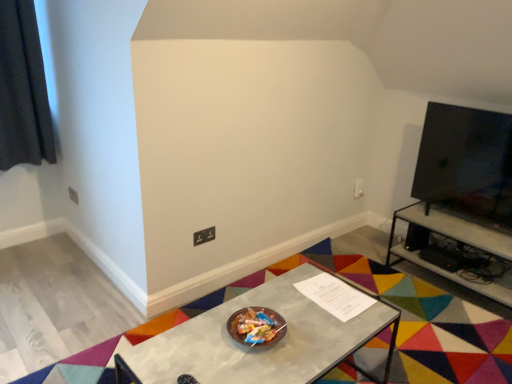
Question: Is metallic gray table at center, marked as the 1th table in a front-to-back arrangement, wider or thinner than matte black power outlet at lower center?

Choices:
 (A) thin
 (B) wide

Answer: (B)

Question: Based on their sizes in the image, would you say metallic gray table at center, arranged as the 2th table when viewed from the back, is bigger or smaller than matte black power outlet at lower center?

Choices:
 (A) small
 (B) big

Answer: (B)

Question: Which is nearer to the matte black power outlet at lower center?

Choices:
 (A) metallic gray table at right, the second table when ordered from left to right
 (B) black fabric curtain at upper left
 (C) metallic gray table at center, marked as the 1th table in a front-to-back arrangement

Answer: (C)

Question: Estimate the real-world distances between objects in this image. Which object is farther from the matte black power outlet at lower center?

Choices:
 (A) metallic gray table at center, arranged as the 2th table when viewed from the back
 (B) metallic gray table at right, the 1th table viewed from the right
 (C) black fabric curtain at upper left

Answer: (C)